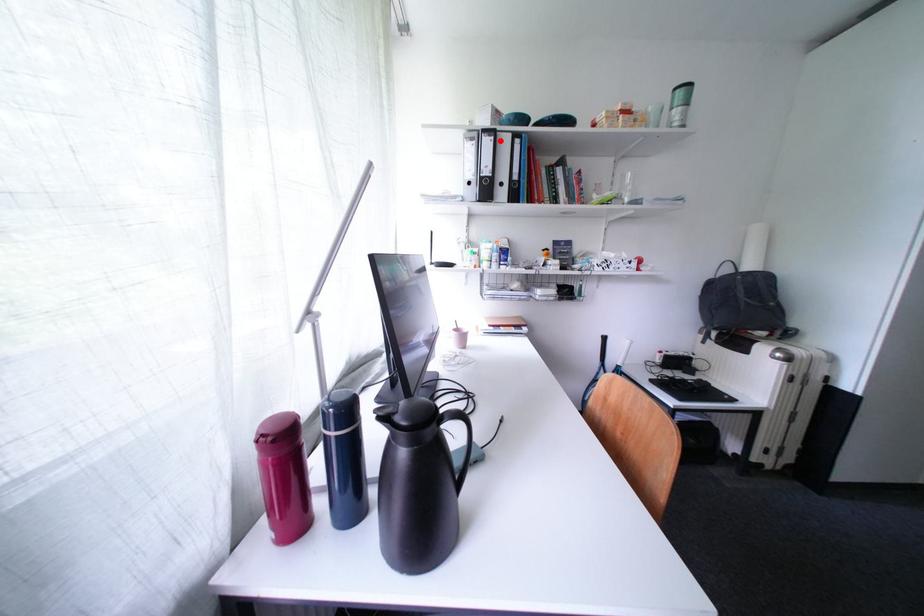
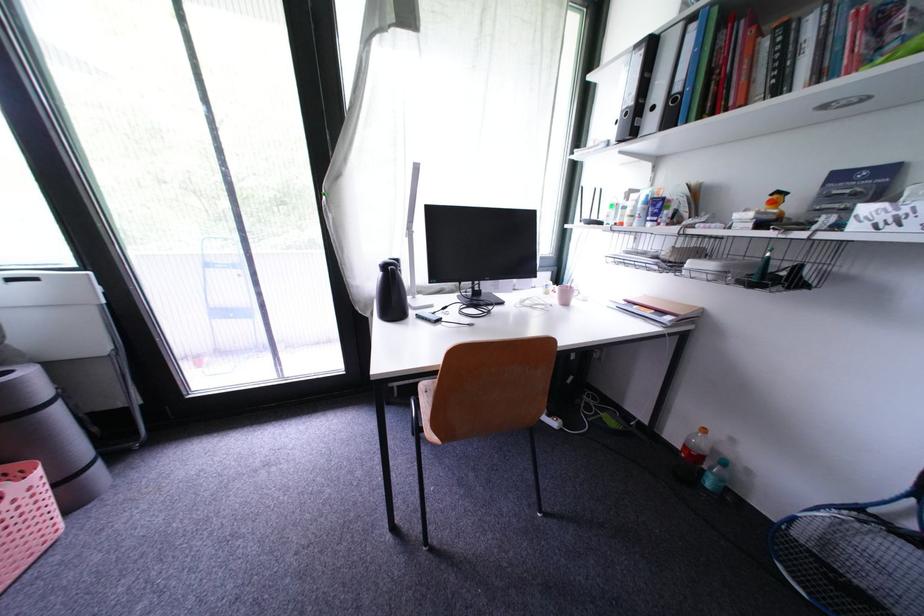
Find the pixel in the second image that matches the highlighted location in the first image.

(650, 54)